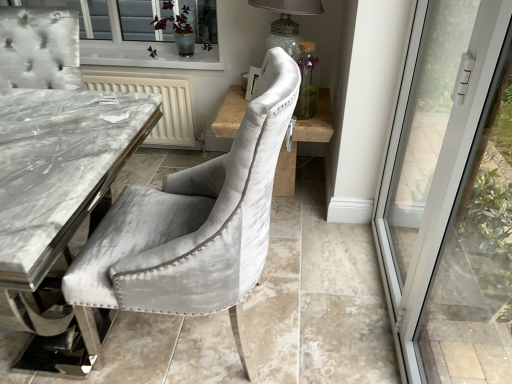
Question: Is velvet chair at center situated inside velvet grey chair at center or outside?

Choices:
 (A) outside
 (B) inside

Answer: (A)

Question: Considering their positions, is velvet chair at center located in front of or behind velvet grey chair at center?

Choices:
 (A) behind
 (B) front

Answer: (A)

Question: Which object is the closest to the purple velvet plant at upper center?

Choices:
 (A) velvet chair at center
 (B) velvet grey chair at center
 (C) light brown wood side table at center
 (D) transparent glass door at right

Answer: (C)

Question: Which of these objects is positioned closest to the transparent glass door at right?

Choices:
 (A) velvet chair at center
 (B) velvet grey chair at center
 (C) light brown wood side table at center
 (D) purple velvet plant at upper center

Answer: (A)